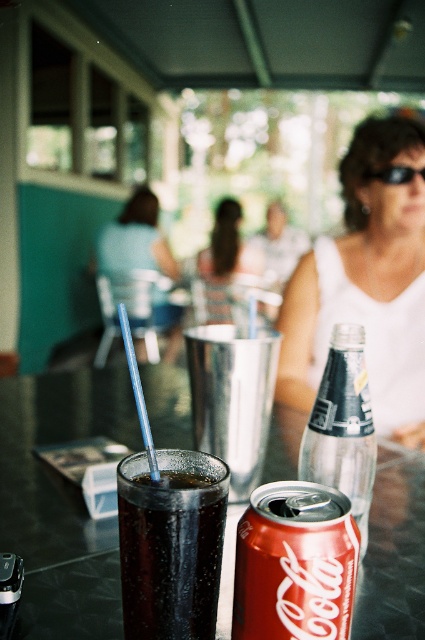
Question: From the image, what is the correct spatial relationship of glossy aluminum can at center in relation to smooth plastic cup at center?

Choices:
 (A) right
 (B) left

Answer: (B)

Question: Can you confirm if glossy plastic table at center is positioned below black plastic goggles at upper center?

Choices:
 (A) no
 (B) yes

Answer: (B)

Question: Among these points, which one is farthest from the camera?

Choices:
 (A) (147, 502)
 (B) (254, 561)
 (C) (421, 177)
 (D) (359, 419)

Answer: (C)

Question: Among these points, which one is farthest from the camera?

Choices:
 (A) (380, 176)
 (B) (295, 364)
 (C) (340, 506)

Answer: (A)

Question: Which of these objects is positioned closest to the matte blue shirt at upper left?

Choices:
 (A) glossy plastic table at center
 (B) clear glass bottle at center

Answer: (A)

Question: Is clear glass bottle at center positioned before matte blue shirt at upper left?

Choices:
 (A) no
 (B) yes

Answer: (B)